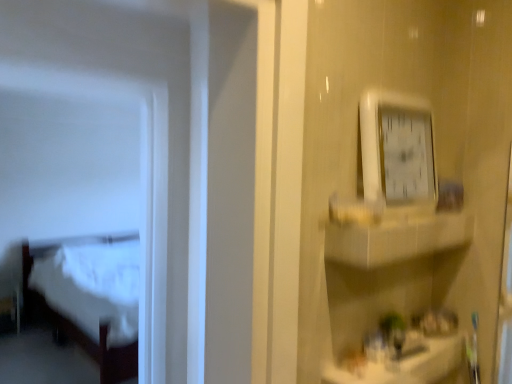
Where is `free location above white glossy counter top at lower right (from a real-world perspective)`? The height and width of the screenshot is (384, 512). free location above white glossy counter top at lower right (from a real-world perspective) is located at coordinates (419, 340).